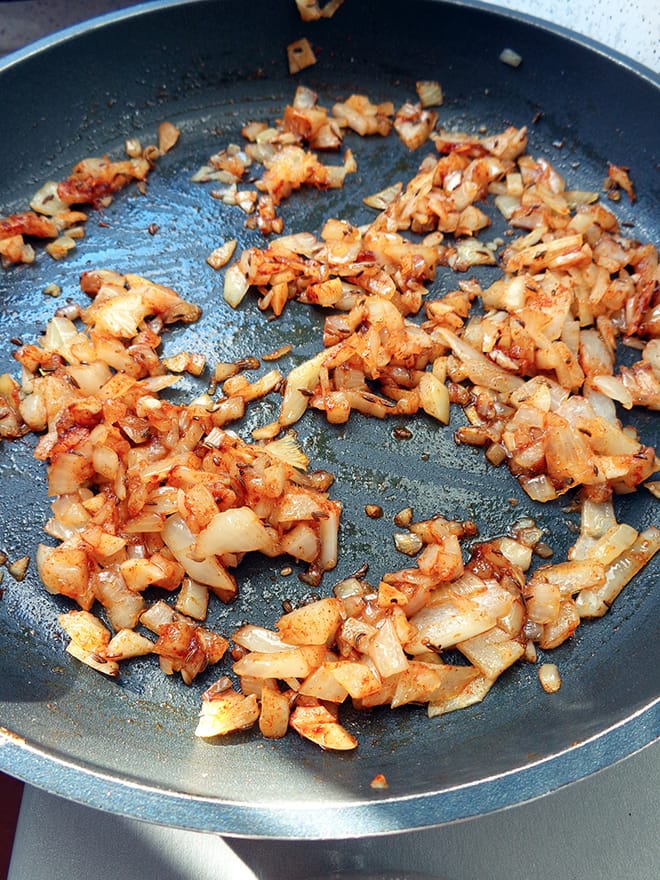
Locate an element on the screen. This screenshot has height=880, width=660. light gray surface is located at coordinates (567, 825).